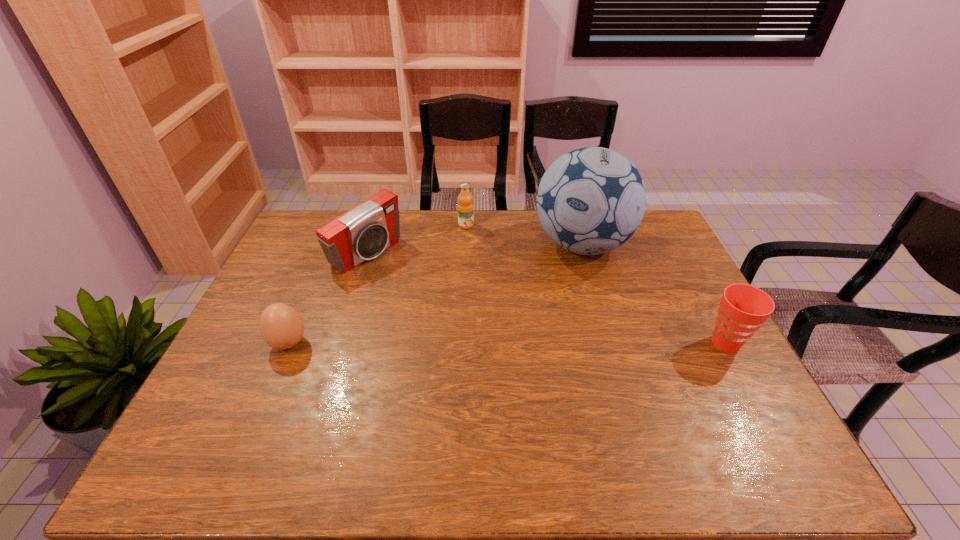
This screenshot has width=960, height=540. What are the coordinates of `object that is at the left edge` in the screenshot? It's located at (281, 326).

In order to click on cup present at the right edge in this screenshot , I will do `click(743, 308)`.

I want to click on soccer ball located in the right edge section of the desktop, so click(590, 201).

You are a GUI agent. You are given a task and a screenshot of the screen. Output one action in this format:
    pyautogui.click(x=<x>, y=<y>)
    Task: Click on the object present at the far right corner
    The height and width of the screenshot is (540, 960).
    Given the screenshot: What is the action you would take?
    pyautogui.click(x=590, y=201)

This screenshot has height=540, width=960. Find the location of `vacant space at the far edge of the desktop`. vacant space at the far edge of the desktop is located at coordinates (487, 217).

Locate an element on the screen. Image resolution: width=960 pixels, height=540 pixels. vacant space at the near edge of the desktop is located at coordinates (509, 395).

In the image, there is a desktop. At what (x,y) coordinates should I click in order to perform the action: click on vacant space at the right edge. Please return your answer as a coordinate pair (x, y). Image resolution: width=960 pixels, height=540 pixels. Looking at the image, I should click on (719, 353).

I want to click on vacant space at the far right corner of the desktop, so click(x=639, y=230).

Locate an element on the screen. The width and height of the screenshot is (960, 540). free spot between the fourth object from left to right and the boiled egg is located at coordinates (435, 294).

Locate an element on the screen. vacant region between the shortest object and the tallest object is located at coordinates (435, 294).